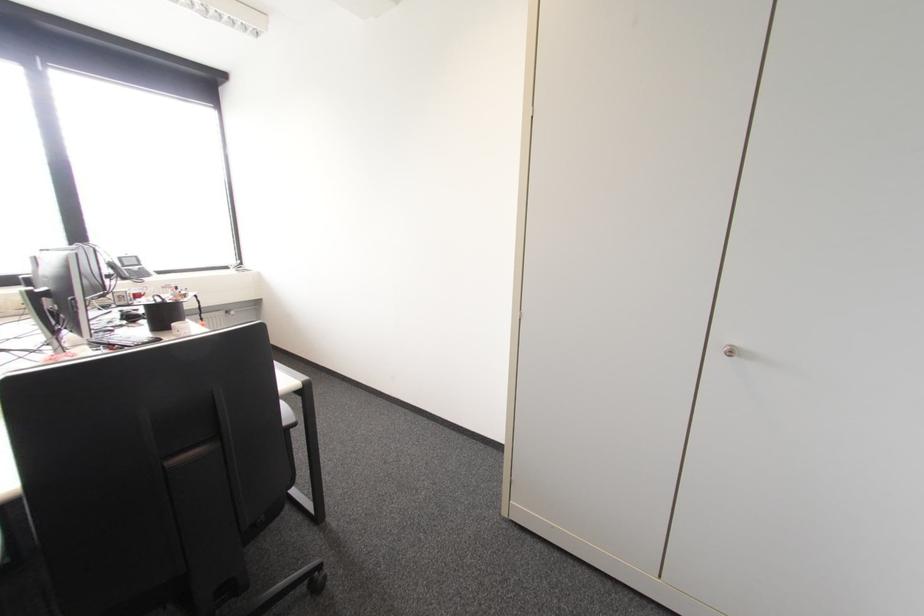
The width and height of the screenshot is (924, 616). What do you see at coordinates (157, 315) in the screenshot? I see `the black pen holder` at bounding box center [157, 315].